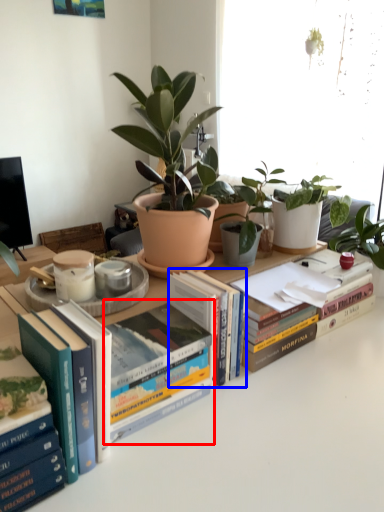
Question: Which object is further to the camera taking this photo, book (highlighted by a red box) or book (highlighted by a blue box)?

Choices:
 (A) book
 (B) book

Answer: (B)